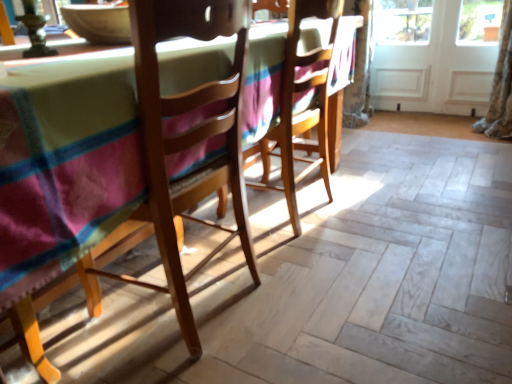
Question: From the image's perspective, is white wooden screen door at right, marked as the second screen door in a right-to-left arrangement, above wooden chair at center, the first chair from the back?

Choices:
 (A) yes
 (B) no

Answer: (A)

Question: Is white wooden screen door at right, arranged as the first screen door when viewed from the left, positioned behind wooden chair at center, the first chair from the back?

Choices:
 (A) yes
 (B) no

Answer: (A)

Question: Could you tell me if white wooden screen door at right, marked as the second screen door in a right-to-left arrangement, is turned towards wooden chair at center, the 2th chair when ordered from front to back?

Choices:
 (A) yes
 (B) no

Answer: (A)

Question: From the image's perspective, would you say white wooden screen door at right, marked as the second screen door in a right-to-left arrangement, is shown under wooden chair at center, the 2th chair when ordered from front to back?

Choices:
 (A) no
 (B) yes

Answer: (A)

Question: Is white wooden screen door at right, arranged as the first screen door when viewed from the left, closer to the viewer compared to wooden chair at center, the 2th chair when ordered from front to back?

Choices:
 (A) yes
 (B) no

Answer: (B)

Question: From a real-world perspective, does white wooden screen door at right, marked as the second screen door in a right-to-left arrangement, sit lower than wooden chair at center, the 2th chair when ordered from front to back?

Choices:
 (A) no
 (B) yes

Answer: (B)

Question: Can you confirm if wooden chair at left, the second chair viewed from the back, is bigger than white wooden screen door at right, arranged as the first screen door when viewed from the left?

Choices:
 (A) no
 (B) yes

Answer: (B)

Question: Can you confirm if wooden chair at left, the second chair viewed from the back, is smaller than white wooden screen door at right, arranged as the first screen door when viewed from the left?

Choices:
 (A) no
 (B) yes

Answer: (A)

Question: Is wooden chair at left, acting as the 1th chair starting from the front, not near white wooden screen door at right, marked as the second screen door in a right-to-left arrangement?

Choices:
 (A) no
 (B) yes

Answer: (B)

Question: Is wooden chair at left, the second chair viewed from the back, oriented away from white wooden screen door at right, marked as the second screen door in a right-to-left arrangement?

Choices:
 (A) yes
 (B) no

Answer: (B)

Question: Considering the relative sizes of wooden chair at left, acting as the 1th chair starting from the front, and white wooden screen door at right, arranged as the first screen door when viewed from the left, in the image provided, is wooden chair at left, acting as the 1th chair starting from the front, shorter than white wooden screen door at right, arranged as the first screen door when viewed from the left,?

Choices:
 (A) yes
 (B) no

Answer: (B)

Question: Is wooden chair at left, acting as the 1th chair starting from the front, wider than white wooden screen door at right, marked as the second screen door in a right-to-left arrangement?

Choices:
 (A) yes
 (B) no

Answer: (A)

Question: Does wooden chair at left, acting as the 1th chair starting from the front, appear on the right side of white wood screen door at upper right, which is the first screen door in right-to-left order?

Choices:
 (A) no
 (B) yes

Answer: (A)